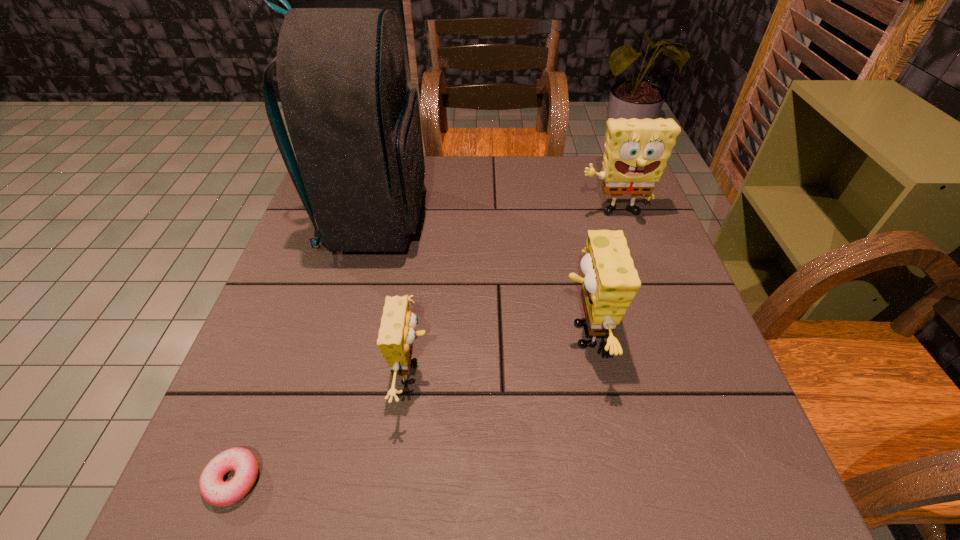
The image size is (960, 540). I want to click on free space at the near edge of the desktop, so click(429, 471).

Where is `free location at the left edge`? The image size is (960, 540). free location at the left edge is located at coordinates (308, 247).

Identify the location of free space at the right edge of the desktop. (637, 261).

At what (x,y) coordinates should I click in order to perform the action: click on vacant area between the fourth tallest object and the nearest object. Please return your answer as a coordinate pair (x, y). The image size is (960, 540). Looking at the image, I should click on (324, 426).

The image size is (960, 540). I want to click on free space between the backpack and the farthest sponge, so click(494, 218).

Find the location of a particular element. free space between the shortest object and the shortest sponge is located at coordinates (324, 426).

The width and height of the screenshot is (960, 540). What are the coordinates of `blank region between the shortest sponge and the doughnut` in the screenshot? It's located at (324, 426).

Choose which object is the nearest neighbor to the tallest object. Please provide its 2D coordinates. Your answer should be formatted as a tuple, i.e. [(x, y)], where the tuple contains the x and y coordinates of a point satisfying the conditions above.

[(396, 335)]

Image resolution: width=960 pixels, height=540 pixels. What are the coordinates of `object that stands as the third closest to the nearest object` in the screenshot? It's located at (610, 281).

Where is `sponge that stands as the second closest to the farthest sponge`? Image resolution: width=960 pixels, height=540 pixels. sponge that stands as the second closest to the farthest sponge is located at coordinates click(x=396, y=335).